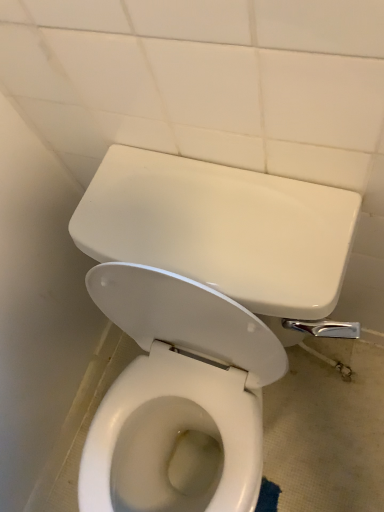
What do you see at coordinates (200, 320) in the screenshot? Image resolution: width=384 pixels, height=512 pixels. I see `white glossy toilet at center` at bounding box center [200, 320].

You are a GUI agent. You are given a task and a screenshot of the screen. Output one action in this format:
    pyautogui.click(x=<x>, y=<y>)
    Task: Click on the white glossy toilet at center
    The height and width of the screenshot is (512, 384).
    Given the screenshot: What is the action you would take?
    pyautogui.click(x=200, y=320)

You are a GUI agent. You are given a task and a screenshot of the screen. Output one action in this format:
    pyautogui.click(x=<x>, y=<y>)
    Task: Click on the white glossy toilet at center
    This screenshot has width=384, height=512.
    Given the screenshot: What is the action you would take?
    pyautogui.click(x=200, y=320)